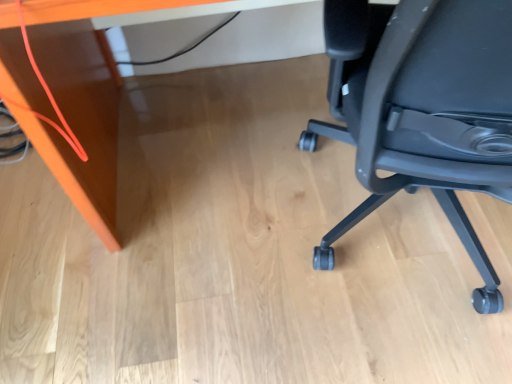
This screenshot has height=384, width=512. What are the coordinates of `matte orange desk at upper left` in the screenshot? It's located at (82, 101).

Describe the element at coordinates (82, 101) in the screenshot. I see `matte orange desk at upper left` at that location.

Identify the location of black plastic chair at right. This screenshot has width=512, height=384. (423, 109).

The image size is (512, 384). What do you see at coordinates (423, 109) in the screenshot? I see `black plastic chair at right` at bounding box center [423, 109].

Find the location of a particular element. matte orange desk at upper left is located at coordinates (82, 101).

Which is more to the right, matte orange desk at upper left or black plastic chair at right?

Positioned to the right is black plastic chair at right.

Which object is closer to the camera taking this photo, matte orange desk at upper left or black plastic chair at right?

Positioned in front is black plastic chair at right.

Does point (81, 33) come behind point (328, 133)?

No, it is in front of (328, 133).

From the image's perspective, does matte orange desk at upper left appear higher than black plastic chair at right?

Yes, from the image's perspective, matte orange desk at upper left is on top of black plastic chair at right.

From a real-world perspective, does matte orange desk at upper left sit lower than black plastic chair at right?

Yes, from a real-world perspective, matte orange desk at upper left is beneath black plastic chair at right.

Does matte orange desk at upper left have a lesser width compared to black plastic chair at right?

Correct, the width of matte orange desk at upper left is less than that of black plastic chair at right.

From their relative heights in the image, would you say matte orange desk at upper left is taller or shorter than black plastic chair at right?

matte orange desk at upper left is shorter than black plastic chair at right.

Who is smaller, matte orange desk at upper left or black plastic chair at right?

Smaller between the two is black plastic chair at right.

Is matte orange desk at upper left inside or outside of black plastic chair at right?

The correct answer is: outside.

Are matte orange desk at upper left and black plastic chair at right beside each other?

They are not placed beside each other.

Is black plastic chair at right at the back of matte orange desk at upper left?

That's not correct — matte orange desk at upper left is not looking away from black plastic chair at right.

How many degrees apart are the facing directions of matte orange desk at upper left and black plastic chair at right?

There is a 164-degree angle between the facing directions of matte orange desk at upper left and black plastic chair at right.

How much distance is there between matte orange desk at upper left and black plastic chair at right?

22.89 inches.

Find the location of a particular element. chair located above the matte orange desk at upper left (from a real-world perspective) is located at coordinates (423, 109).

Which is more to the right, black plastic chair at right or matte orange desk at upper left?

black plastic chair at right.

Considering the positions of objects black plastic chair at right and matte orange desk at upper left in the image provided, who is behind, black plastic chair at right or matte orange desk at upper left?

matte orange desk at upper left.

Which is behind, point (337, 100) or point (26, 61)?

The point (337, 100) is behind.

From the image's perspective, is black plastic chair at right located beneath matte orange desk at upper left?

Yes.

From a real-world perspective, is black plastic chair at right over matte orange desk at upper left?

Yes, from a real-world perspective, black plastic chair at right is above matte orange desk at upper left.

Which object is wider, black plastic chair at right or matte orange desk at upper left?

black plastic chair at right is wider.

In the scene shown: Between black plastic chair at right and matte orange desk at upper left, which one has more height?

Standing taller between the two is black plastic chair at right.

Between black plastic chair at right and matte orange desk at upper left, which one has larger size?

Bigger between the two is matte orange desk at upper left.

Is black plastic chair at right spatially inside matte orange desk at upper left, or outside of it?

black plastic chair at right is outside matte orange desk at upper left.

Is black plastic chair at right in contact with matte orange desk at upper left?

black plastic chair at right and matte orange desk at upper left are not in contact.

Could you tell me if black plastic chair at right is turned towards matte orange desk at upper left?

Yes, black plastic chair at right is turned towards matte orange desk at upper left.

Can you tell me how much black plastic chair at right and matte orange desk at upper left differ in facing direction?

164 degrees.

Locate an element on the screen. Image resolution: width=512 pixels, height=384 pixels. desk on the left of black plastic chair at right is located at coordinates (82, 101).

This screenshot has height=384, width=512. Find the location of `chair that is below the matte orange desk at upper left (from the image's perspective)`. chair that is below the matte orange desk at upper left (from the image's perspective) is located at coordinates (423, 109).

At what (x,y) coordinates should I click in order to perform the action: click on desk that appears above the black plastic chair at right (from the image's perspective). Please return your answer as a coordinate pair (x, y). Looking at the image, I should click on (82, 101).